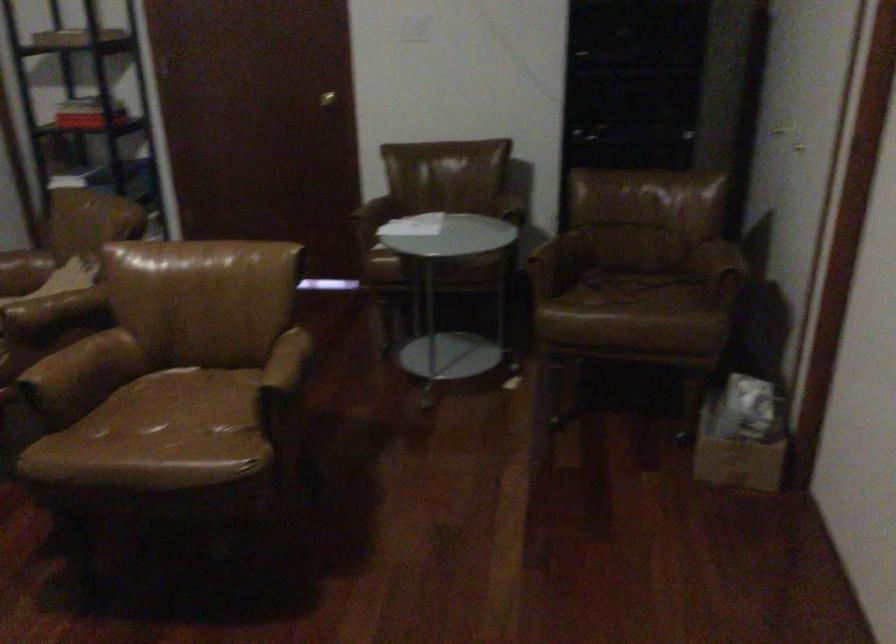
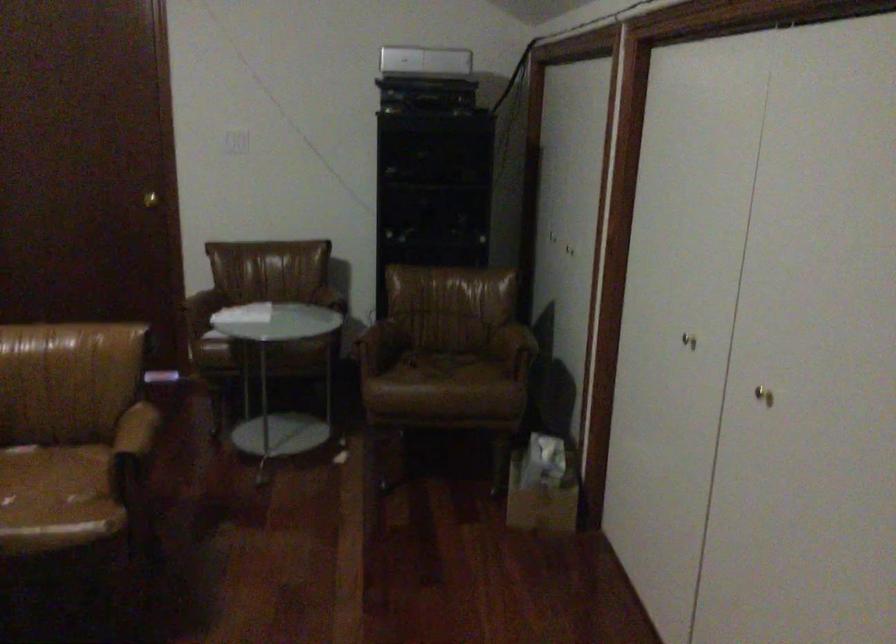
Question: How did the camera likely rotate?

Choices:
 (A) Left
 (B) Right
 (C) Up
 (D) Down

Answer: (B)